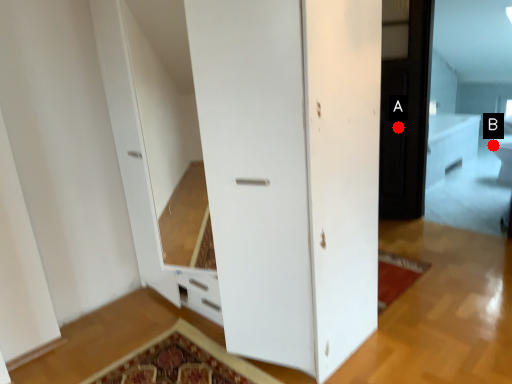
Question: Two points are circled on the image, labeled by A and B beside each circle. Which point is closer to the camera taking this photo?

Choices:
 (A) A is closer
 (B) B is closer

Answer: (A)